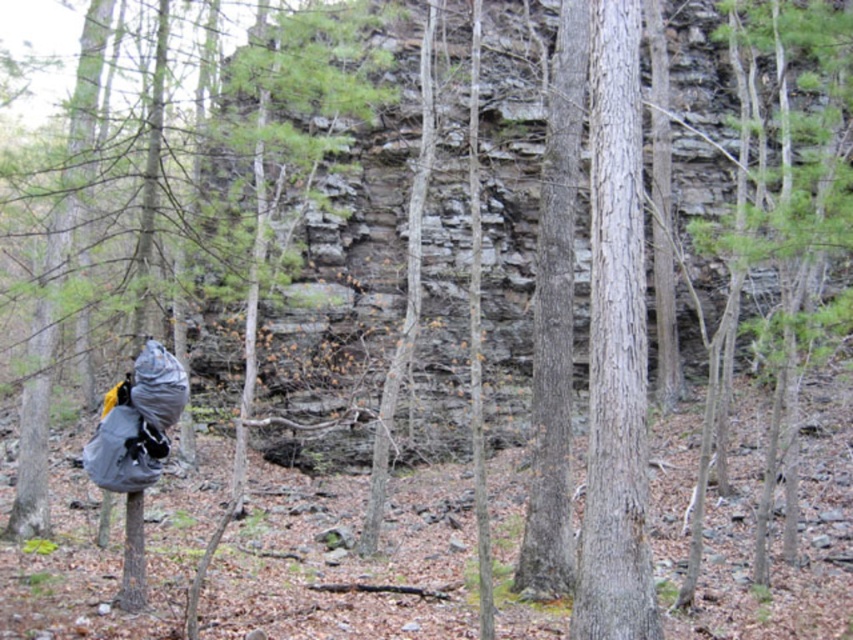
Question: Among these points, which one is nearest to the camera?

Choices:
 (A) (538, 346)
 (B) (624, 88)

Answer: (B)

Question: Does gray rough bark tree at center have a lesser width compared to smooth bark tree at center?

Choices:
 (A) no
 (B) yes

Answer: (A)

Question: Observing the image, what is the correct spatial positioning of gray rough bark tree at center in reference to smooth bark tree at center?

Choices:
 (A) below
 (B) above

Answer: (A)

Question: Which object is farther from the camera taking this photo?

Choices:
 (A) gray rough bark tree at center
 (B) smooth bark tree at center

Answer: (B)

Question: Does gray rough bark tree at center lie in front of smooth bark tree at center?

Choices:
 (A) yes
 (B) no

Answer: (A)